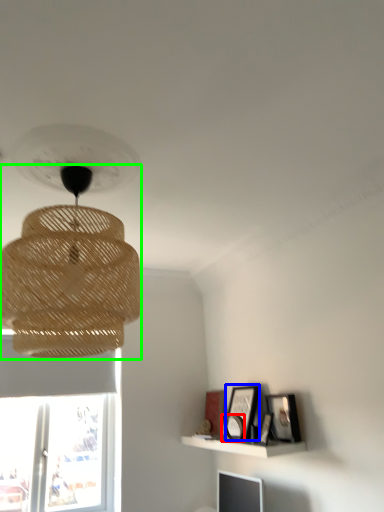
Question: Considering the real-world distances, which object is farthest from picture frame (highlighted by a red box)? picture frame (highlighted by a blue box) or lamp (highlighted by a green box)?

Choices:
 (A) picture frame
 (B) lamp

Answer: (B)